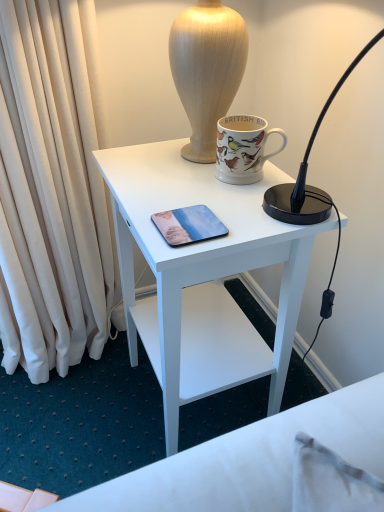
Question: Does metallic glossy phone at center have a greater width compared to white matte desk at center?

Choices:
 (A) yes
 (B) no

Answer: (B)

Question: Can you confirm if metallic glossy phone at center is positioned to the left of white matte desk at center?

Choices:
 (A) yes
 (B) no

Answer: (A)

Question: Is metallic glossy phone at center next to white matte desk at center?

Choices:
 (A) yes
 (B) no

Answer: (B)

Question: Could you tell me if metallic glossy phone at center is facing white matte desk at center?

Choices:
 (A) no
 (B) yes

Answer: (A)

Question: Is metallic glossy phone at center positioned beyond the bounds of white matte desk at center?

Choices:
 (A) no
 (B) yes

Answer: (A)

Question: Does metallic glossy phone at center have a larger size compared to white matte desk at center?

Choices:
 (A) yes
 (B) no

Answer: (B)

Question: Considering the relative sizes of matte ceramic mug at upper center and white matte desk at center in the image provided, is matte ceramic mug at upper center smaller than white matte desk at center?

Choices:
 (A) yes
 (B) no

Answer: (A)

Question: Could you tell me if matte ceramic mug at upper center is facing white matte desk at center?

Choices:
 (A) yes
 (B) no

Answer: (B)

Question: Is matte ceramic mug at upper center in contact with white matte desk at center?

Choices:
 (A) no
 (B) yes

Answer: (A)

Question: Is matte ceramic mug at upper center thinner than white matte desk at center?

Choices:
 (A) yes
 (B) no

Answer: (A)

Question: Does matte ceramic mug at upper center lie behind white matte desk at center?

Choices:
 (A) no
 (B) yes

Answer: (B)

Question: Is matte ceramic mug at upper center positioned with its back to white matte desk at center?

Choices:
 (A) yes
 (B) no

Answer: (B)

Question: From the image's perspective, does white matte desk at center appear lower than metallic glossy phone at center?

Choices:
 (A) no
 (B) yes

Answer: (B)